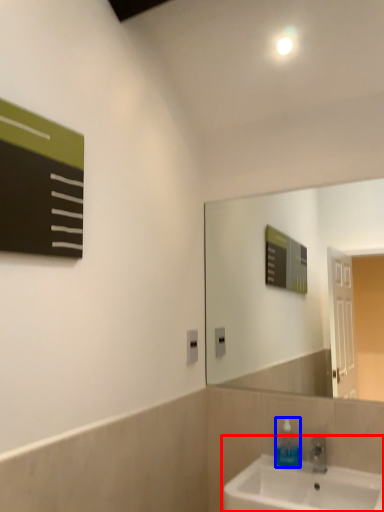
Question: Which of the following is the farthest to the observer, sink (highlighted by a red box) or soap dispenser (highlighted by a blue box)?

Choices:
 (A) sink
 (B) soap dispenser

Answer: (B)